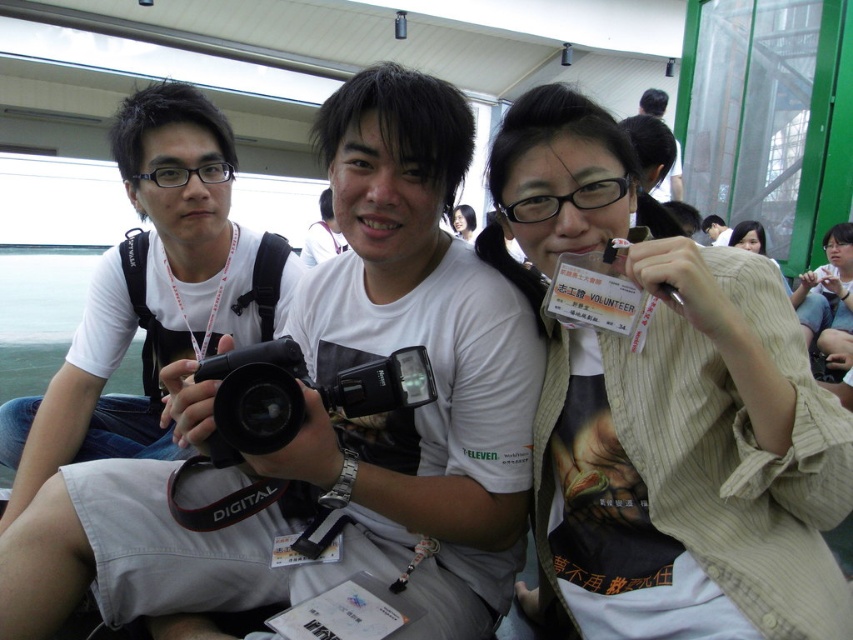
Question: Which object is closer to the camera taking this photo?

Choices:
 (A) black plastic camera at center
 (B) black matte camera at center
 (C) striped beige shirt at center
 (D) white striped shirt at center

Answer: (C)

Question: Which point is closer to the camera?

Choices:
 (A) (651, 88)
 (B) (242, 440)
 (C) (636, 355)

Answer: (B)

Question: Does striped beige shirt at center lie behind black plastic camera at center?

Choices:
 (A) no
 (B) yes

Answer: (A)

Question: Considering the relative positions of black matte camera at center and matte white shirt at center in the image provided, where is black matte camera at center located with respect to matte white shirt at center?

Choices:
 (A) below
 (B) above

Answer: (B)

Question: Which object is the closest to the matte white shirt at center?

Choices:
 (A) black plastic camera at center
 (B) black matte camera at center
 (C) striped beige shirt at center

Answer: (B)

Question: Is black matte camera at center closer to the viewer compared to white striped shirt at center?

Choices:
 (A) yes
 (B) no

Answer: (B)